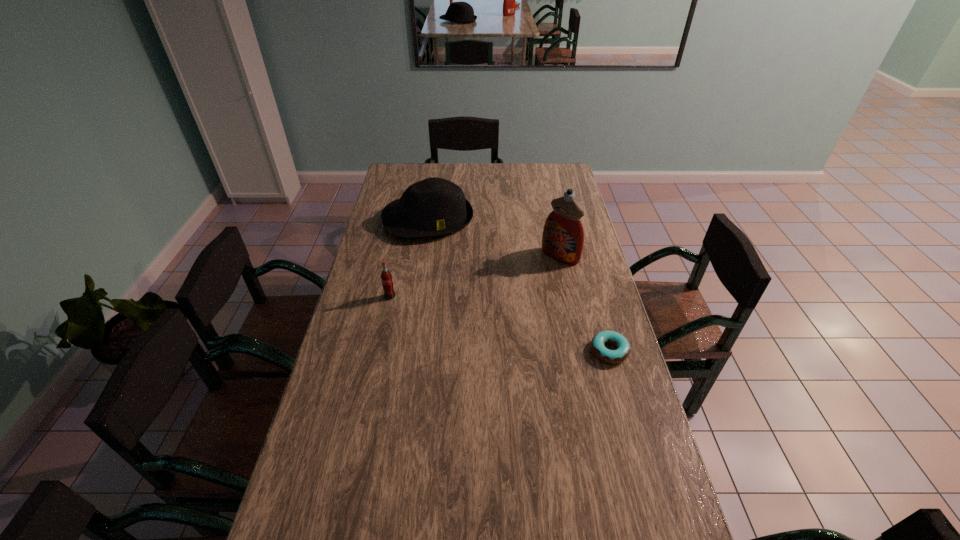
Locate an element on the screen. Image resolution: width=960 pixels, height=540 pixels. free spot on the desktop that is between the second nearest object and the doughnut and is positioned on the front surface of the third nearest object is located at coordinates (492, 322).

Locate an element on the screen. vacant space on the desktop that is between the third farthest object and the nearest object and is positioned on the front-facing side of the farthest object is located at coordinates (468, 316).